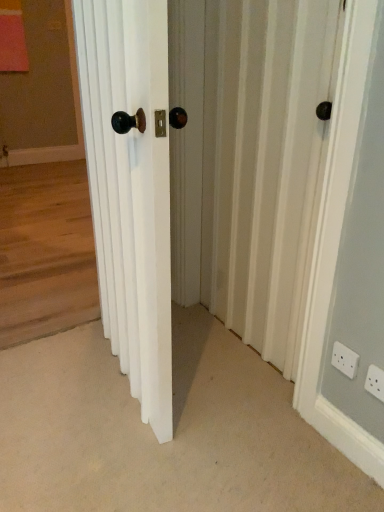
Question: From the image's perspective, is white plastic electric outlet at lower right, placed as the first electric outlet when sorted from front to back, below white textured screen door at center?

Choices:
 (A) yes
 (B) no

Answer: (A)

Question: From a real-world perspective, is white plastic electric outlet at lower right, the second electric outlet positioned from the left, under white textured screen door at center?

Choices:
 (A) yes
 (B) no

Answer: (A)

Question: Is white plastic electric outlet at lower right, the second electric outlet when ordered from back to front, bigger than white textured screen door at center?

Choices:
 (A) yes
 (B) no

Answer: (B)

Question: From a real-world perspective, is white plastic electric outlet at lower right, placed as the first electric outlet when sorted from front to back, on top of white textured screen door at center?

Choices:
 (A) yes
 (B) no

Answer: (B)

Question: Is white plastic electric outlet at lower right, placed as the first electric outlet when sorted from front to back, to the left of white textured screen door at center from the viewer's perspective?

Choices:
 (A) no
 (B) yes

Answer: (A)

Question: Is wooden floor at left in front of or behind white wooden door at center in the image?

Choices:
 (A) behind
 (B) front

Answer: (A)

Question: From their relative heights in the image, would you say wooden floor at left is taller or shorter than white wooden door at center?

Choices:
 (A) short
 (B) tall

Answer: (A)

Question: Is wooden floor at left bigger or smaller than white wooden door at center?

Choices:
 (A) big
 (B) small

Answer: (B)

Question: From the image's perspective, is wooden floor at left positioned above or below white wooden door at center?

Choices:
 (A) below
 (B) above

Answer: (B)

Question: From a real-world perspective, is wooden floor at left positioned above or below white plastic electric outlet at lower right, the first electric outlet from the back?

Choices:
 (A) above
 (B) below

Answer: (A)

Question: In the image, is wooden floor at left positioned in front of or behind white plastic electric outlet at lower right, the first electric outlet from the back?

Choices:
 (A) behind
 (B) front

Answer: (A)

Question: Is point (82, 309) closer or farther from the camera than point (340, 368)?

Choices:
 (A) closer
 (B) farther

Answer: (B)

Question: Is wooden floor at left wider or thinner than white plastic electric outlet at lower right, positioned as the 2th electric outlet in right-to-left order?

Choices:
 (A) thin
 (B) wide

Answer: (B)

Question: From a real-world perspective, is white wooden door at center above or below white textured screen door at center?

Choices:
 (A) below
 (B) above

Answer: (A)

Question: Would you say white wooden door at center is to the left or to the right of white textured screen door at center in the picture?

Choices:
 (A) left
 (B) right

Answer: (A)